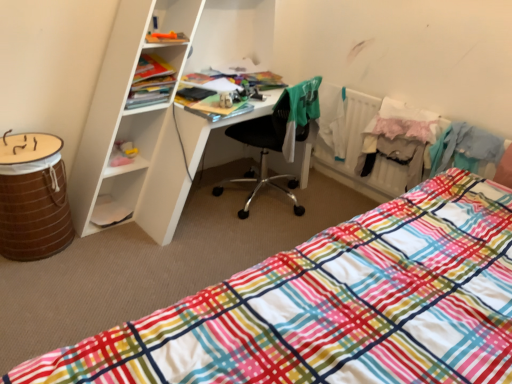
This screenshot has height=384, width=512. Identify the location of vacant area in front of brown woven barrel at lower left. coord(37,283).